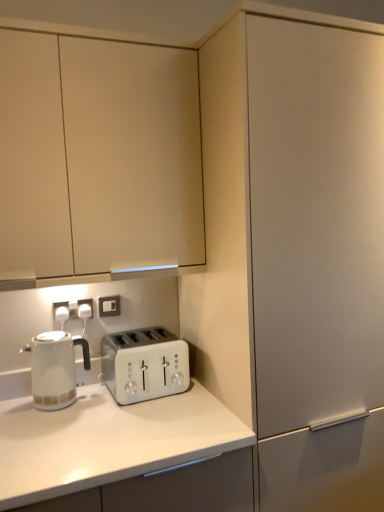
Question: From the image's perspective, is white plastic electric outlet at lower left, acting as the 1th electric outlet starting from the front, below white plastic toaster at center?

Choices:
 (A) yes
 (B) no

Answer: (B)

Question: Can you confirm if white plastic electric outlet at lower left, the second electric outlet in the back-to-front sequence, is smaller than white plastic toaster at center?

Choices:
 (A) yes
 (B) no

Answer: (A)

Question: Are white plastic electric outlet at lower left, the second electric outlet in the back-to-front sequence, and white plastic toaster at center beside each other?

Choices:
 (A) yes
 (B) no

Answer: (B)

Question: From the image's perspective, is white plastic electric outlet at lower left, arranged as the 2th electric outlet when viewed from the right, above white plastic toaster at center?

Choices:
 (A) no
 (B) yes

Answer: (B)

Question: Is white plastic electric outlet at lower left, arranged as the 2th electric outlet when viewed from the right, located outside white plastic toaster at center?

Choices:
 (A) yes
 (B) no

Answer: (A)

Question: In the image, is matte white cabinet at center, placed as the second cabinetry when sorted from left to right, on the left side or the right side of white plastic toaster at center?

Choices:
 (A) right
 (B) left

Answer: (A)

Question: From a real-world perspective, is matte white cabinet at center, positioned as the 1th cabinetry in right-to-left order, positioned above or below white plastic toaster at center?

Choices:
 (A) above
 (B) below

Answer: (A)

Question: Considering the positions of point (256, 106) and point (175, 375), is point (256, 106) closer or farther from the camera than point (175, 375)?

Choices:
 (A) farther
 (B) closer

Answer: (B)

Question: Is matte white cabinet at center, positioned as the 1th cabinetry in right-to-left order, bigger or smaller than white plastic toaster at center?

Choices:
 (A) small
 (B) big

Answer: (B)

Question: From their relative heights in the image, would you say white glossy kettle at left is taller or shorter than white plastic electric outlet at lower left, placed as the first electric outlet when sorted from left to right?

Choices:
 (A) tall
 (B) short

Answer: (A)

Question: In the image, is white glossy kettle at left on the left side or the right side of white plastic electric outlet at lower left, acting as the 1th electric outlet starting from the front?

Choices:
 (A) left
 (B) right

Answer: (B)

Question: Is white glossy kettle at left in front of or behind white plastic electric outlet at lower left, arranged as the 2th electric outlet when viewed from the right, in the image?

Choices:
 (A) behind
 (B) front

Answer: (B)

Question: Is point (74, 343) positioned closer to the camera than point (57, 318)?

Choices:
 (A) farther
 (B) closer

Answer: (A)

Question: Is white plastic toaster at center bigger or smaller than matte white cabinet at center, positioned as the 1th cabinetry in right-to-left order?

Choices:
 (A) small
 (B) big

Answer: (A)

Question: In the image, is white plastic toaster at center on the left side or the right side of matte white cabinet at center, placed as the second cabinetry when sorted from left to right?

Choices:
 (A) right
 (B) left

Answer: (B)